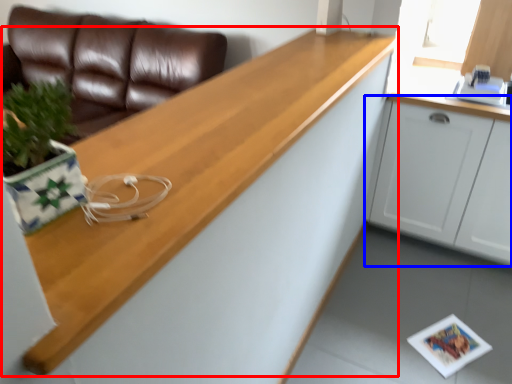
Question: Which object is further to the camera taking this photo, countertop (highlighted by a red box) or cabinetry (highlighted by a blue box)?

Choices:
 (A) countertop
 (B) cabinetry

Answer: (B)